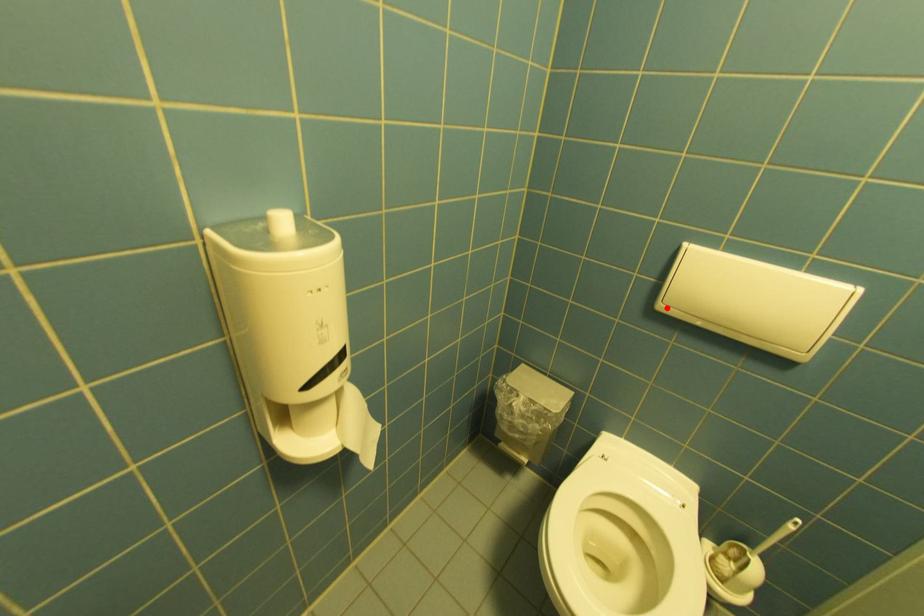
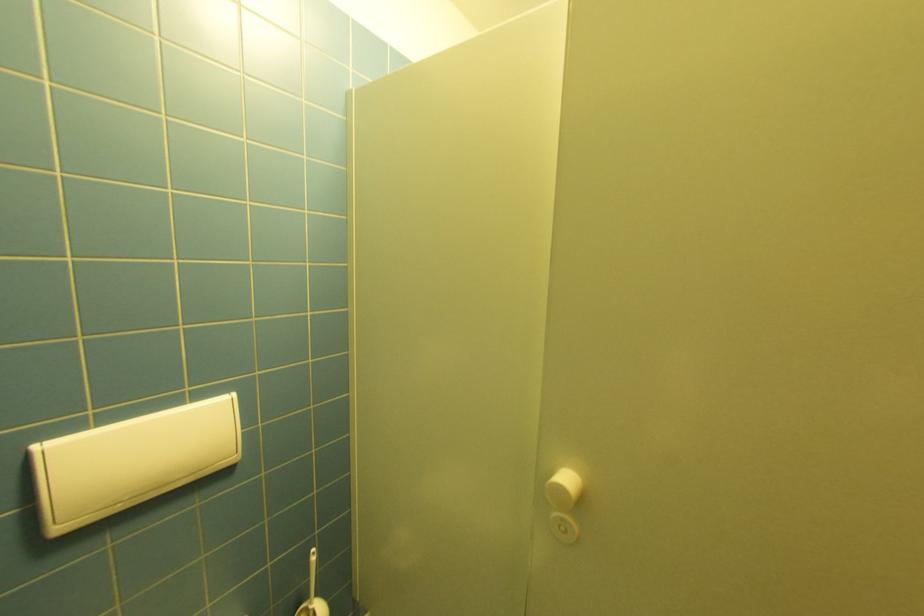
The point at the highlighted location is marked in the first image. Where is the corresponding point in the second image?

(66, 530)